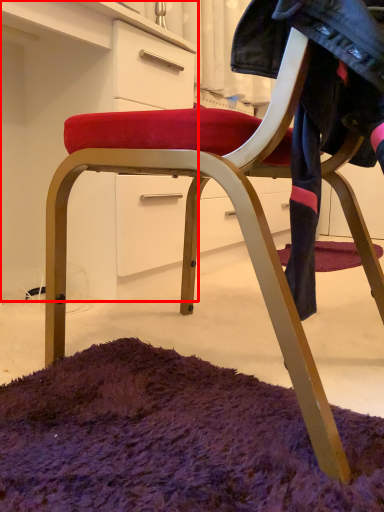
Question: From the image, what is the correct spatial relationship of dresser (annotated by the red box) in relation to clothing?

Choices:
 (A) right
 (B) left

Answer: (B)